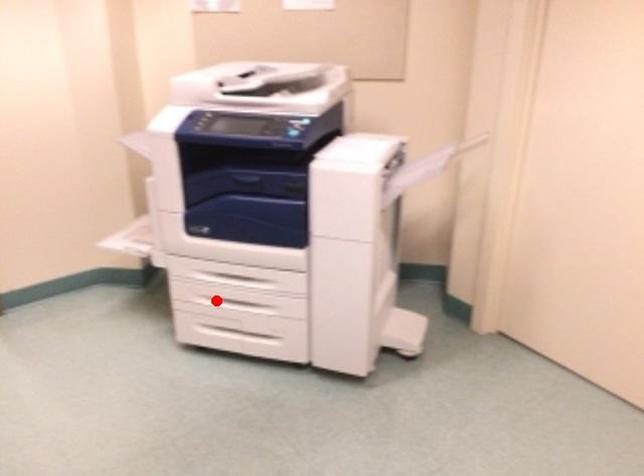
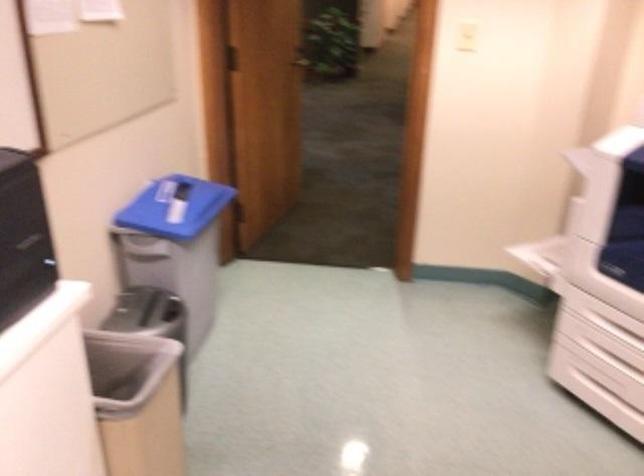
Find the pixel in the second image that matches the highlighted location in the first image.

(611, 359)